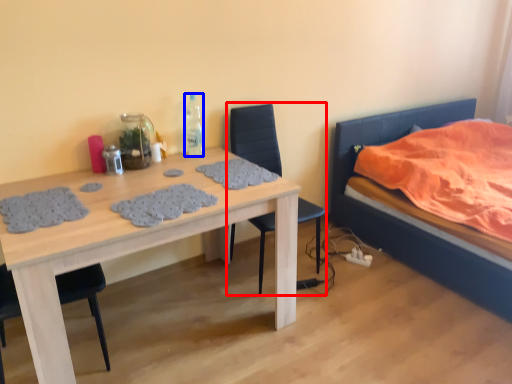
Question: Which object is further to the camera taking this photo, chair (highlighted by a red box) or bottle (highlighted by a blue box)?

Choices:
 (A) chair
 (B) bottle

Answer: (B)